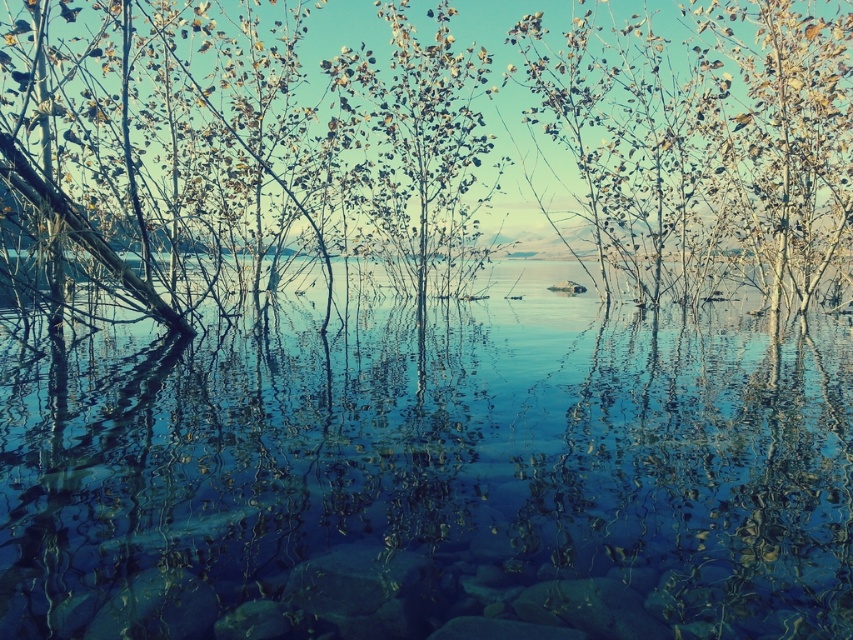
You are standing at the lakeside and notice two points marked on the image. The first point is at coordinates point (515, 566) and the second is at point (370, 248). Which point is closer to you?

Point (515, 566) is in front of point (370, 248), so the first point is closer to you.

You are an artist wanting to paint the lakeside scene. You notice the clear glass water at center and the green leafy tree at center. Which object takes up more space in the image?

The green leafy tree at center occupies more space than the clear glass water at center in the image.